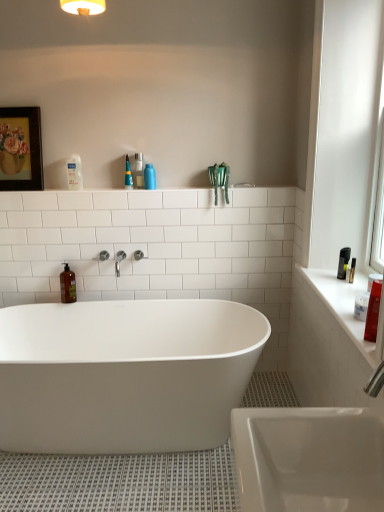
Question: Considering the relative positions of translucent plastic spray bottle at upper center, the fourth cleaning product positioned from the bottom, and blue matte bottle at upper center, which is the third cleaning product in left-to-right order, in the image provided, is translucent plastic spray bottle at upper center, the fourth cleaning product positioned from the bottom, to the right of blue matte bottle at upper center, which is the third cleaning product in left-to-right order, from the viewer's perspective?

Choices:
 (A) no
 (B) yes

Answer: (A)

Question: Is translucent plastic spray bottle at upper center, the 3th cleaning product from the front, facing away from blue matte bottle at upper center, which is counted as the third cleaning product, starting from the bottom?

Choices:
 (A) no
 (B) yes

Answer: (A)

Question: Considering the relative positions of translucent plastic spray bottle at upper center, marked as the second cleaning product in a back-to-front arrangement, and blue matte bottle at upper center, which appears as the second cleaning product when viewed from the top, in the image provided, is translucent plastic spray bottle at upper center, marked as the second cleaning product in a back-to-front arrangement, behind blue matte bottle at upper center, which appears as the second cleaning product when viewed from the top,?

Choices:
 (A) yes
 (B) no

Answer: (A)

Question: Is translucent plastic spray bottle at upper center, the 3th cleaning product from the front, not inside blue matte bottle at upper center, which is counted as the third cleaning product, starting from the bottom?

Choices:
 (A) no
 (B) yes

Answer: (B)

Question: From a real-world perspective, is translucent plastic spray bottle at upper center, marked as the second cleaning product in a back-to-front arrangement, beneath blue matte bottle at upper center, which appears as the second cleaning product when viewed from the top?

Choices:
 (A) no
 (B) yes

Answer: (A)

Question: In terms of height, does blue matte bottle at upper center, which is the third cleaning product in left-to-right order, look taller or shorter compared to translucent plastic spray bottle at upper center, placed as the 3th cleaning product when sorted from right to left?

Choices:
 (A) tall
 (B) short

Answer: (B)

Question: Is blue matte bottle at upper center, which appears as the second cleaning product when viewed from the top, to the left or to the right of translucent plastic spray bottle at upper center, the fourth cleaning product positioned from the bottom, in the image?

Choices:
 (A) right
 (B) left

Answer: (A)

Question: Relative to translucent plastic spray bottle at upper center, marked as the second cleaning product in a back-to-front arrangement, is blue matte bottle at upper center, which is counted as the third cleaning product, starting from the bottom, in front or behind?

Choices:
 (A) front
 (B) behind

Answer: (A)

Question: From the image's perspective, is blue matte bottle at upper center, the 2th cleaning product positioned from the front, located above or below translucent plastic spray bottle at upper center, the 3th cleaning product from the front?

Choices:
 (A) above
 (B) below

Answer: (B)

Question: From a real-world perspective, is clear plastic bottle at upper left, which is the second toiletry from right to left, positioned above or below clear plastic bottle at upper center, acting as the 1th toiletry starting from the right?

Choices:
 (A) below
 (B) above

Answer: (B)

Question: Based on their positions, is clear plastic bottle at upper left, which appears as the first toiletry when viewed from the left, located to the left or right of clear plastic bottle at upper center, acting as the 1th toiletry starting from the right?

Choices:
 (A) right
 (B) left

Answer: (B)

Question: Considering the positions of clear plastic bottle at upper left, which appears as the first toiletry when viewed from the left, and clear plastic bottle at upper center, acting as the 1th toiletry starting from the right, in the image, is clear plastic bottle at upper left, which appears as the first toiletry when viewed from the left, bigger or smaller than clear plastic bottle at upper center, acting as the 1th toiletry starting from the right,?

Choices:
 (A) small
 (B) big

Answer: (B)

Question: From the image's perspective, is clear plastic bottle at upper left, which appears as the first toiletry when viewed from the left, positioned above or below clear plastic bottle at upper center, placed as the second toiletry when sorted from left to right?

Choices:
 (A) above
 (B) below

Answer: (B)

Question: Considering the positions of brown matte bottle at left, the first cleaning product when ordered from left to right, and polished chrome faucet at center in the image, is brown matte bottle at left, the first cleaning product when ordered from left to right, taller or shorter than polished chrome faucet at center?

Choices:
 (A) short
 (B) tall

Answer: (B)

Question: Does point (69, 275) appear closer or farther from the camera than point (119, 263)?

Choices:
 (A) farther
 (B) closer

Answer: (A)